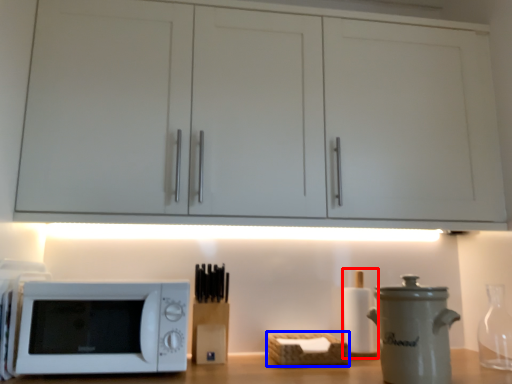
Question: Which object appears closest to the camera in this image, bottle (highlighted by a red box) or basket (highlighted by a blue box)?

Choices:
 (A) bottle
 (B) basket

Answer: (B)